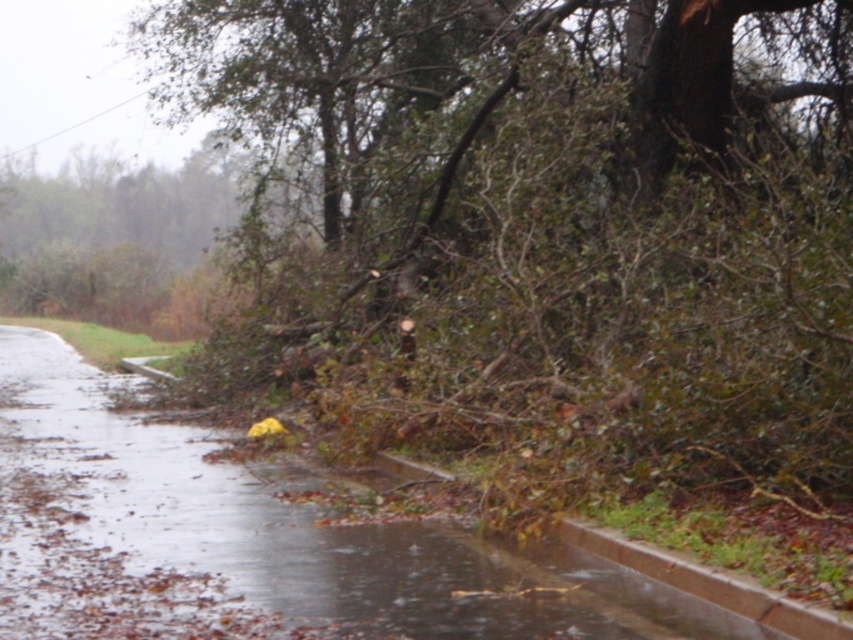
You are a delivery driver trying to navigate through the storm damage. You see the wet concrete flood at lower left and the brown concrete curb at lower right. Which one is higher in elevation?

The wet concrete flood at lower left is located above the brown concrete curb at lower right, so the wet concrete flood at lower left has higher elevation.

You are a city worker assessing storm damage. You need to clear the road blocked by the brown rough tree at center and the brown concrete curb at lower right. Which object is taller and needs to be addressed first for safety?

The brown rough tree at center is taller than the brown concrete curb at lower right, so it should be addressed first for safety.

You are a delivery driver trying to navigate through the storm damage area. You see the brown rough tree at center and the wet concrete flood at lower left. Which obstacle is higher in height that you need to be cautious about?

The brown rough tree at center is taller than the wet concrete flood at lower left, so you need to be cautious about the brown rough tree at center as it is higher in height.